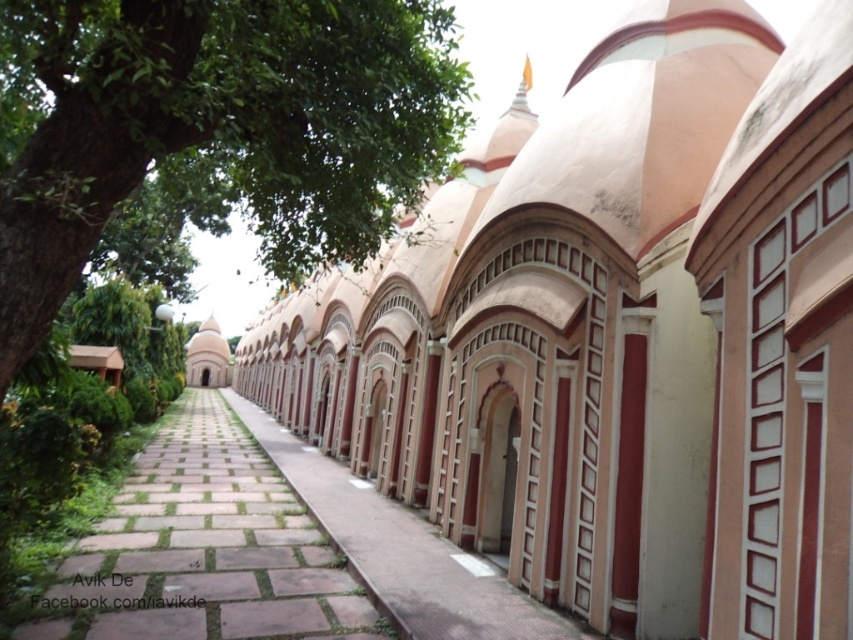
Question: Does brown stone path at center appear on the left side of pink stone pathway at center?

Choices:
 (A) yes
 (B) no

Answer: (A)

Question: Among these objects, which one is nearest to the camera?

Choices:
 (A) pink stone archway at center
 (B) pink stone pathway at center
 (C) brown stone path at center
 (D) green leafy tree at upper left

Answer: (A)

Question: Does green leafy tree at upper left have a lesser width compared to pink stone pathway at center?

Choices:
 (A) yes
 (B) no

Answer: (A)

Question: Which object is positioned farthest from the brown stone path at center?

Choices:
 (A) pink stone archway at center
 (B) pink stone pathway at center
 (C) green leafy tree at upper left

Answer: (C)

Question: Which point is closer to the camera?

Choices:
 (A) (419, 90)
 (B) (410, 525)

Answer: (A)

Question: Is pink stone archway at center smaller than green leafy tree at upper left?

Choices:
 (A) no
 (B) yes

Answer: (A)